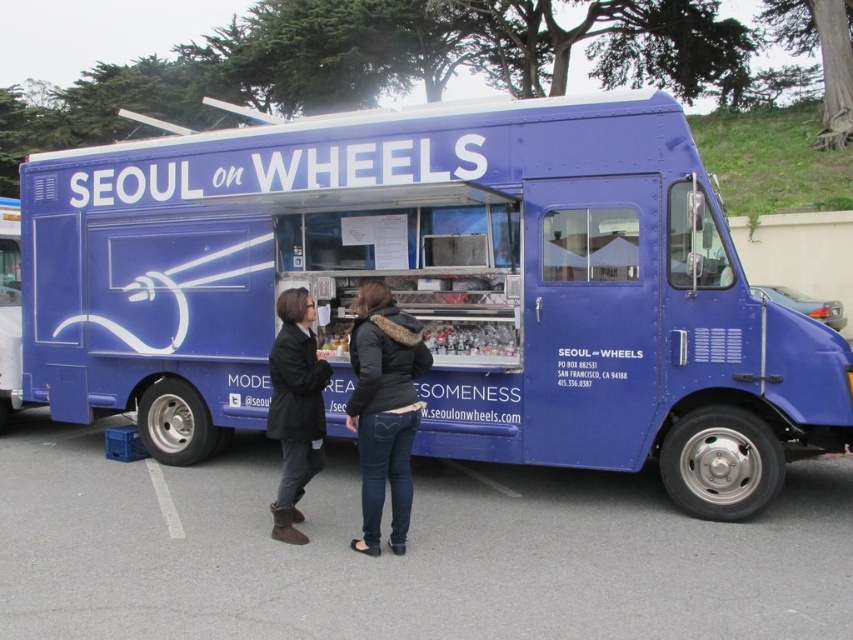
Can you confirm if gray asphalt at lower center is positioned above dark brown leather boots at lower center?

No, gray asphalt at lower center is not above dark brown leather boots at lower center.

Is point (579, 621) positioned behind point (288, 376)?

No, (579, 621) is closer to viewer.

At what (x,y) coordinates should I click in order to perform the action: click on gray asphalt at lower center. Please return your answer as a coordinate pair (x, y). Looking at the image, I should click on (405, 556).

At what (x,y) coordinates should I click in order to perform the action: click on gray asphalt at lower center. Please return your answer as a coordinate pair (x, y). The width and height of the screenshot is (853, 640). Looking at the image, I should click on (405, 556).

Can you confirm if dark blue leather jacket at center is wider than dark brown leather boots at lower center?

Yes, dark blue leather jacket at center is wider than dark brown leather boots at lower center.

Who is taller, dark blue leather jacket at center or dark brown leather boots at lower center?

dark blue leather jacket at center is taller.

Is point (312, 449) positioned in front of point (294, 317)?

No, it is not.

I want to click on dark blue leather jacket at center, so click(x=384, y=408).

Is point (102, 576) positioned after point (283, 451)?

No, it is in front of (283, 451).

Locate an element on the screen. The height and width of the screenshot is (640, 853). gray asphalt at lower center is located at coordinates (405, 556).